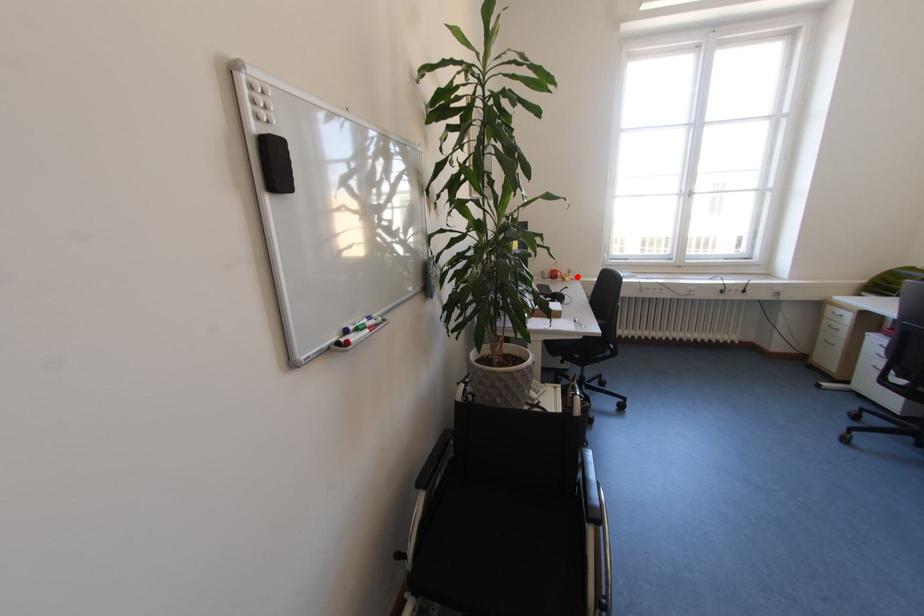
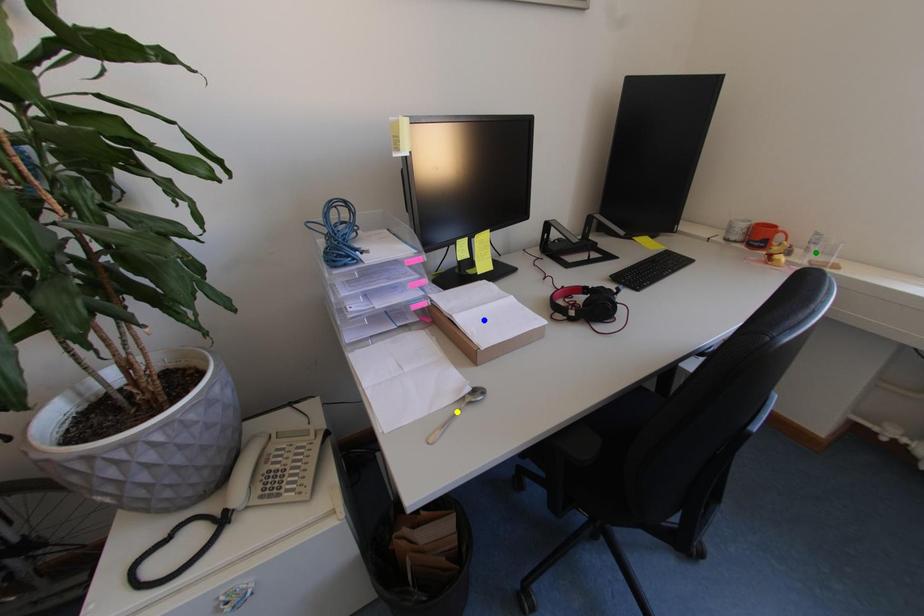
Question: I am providing you with two images of the same scene from different viewpoints. A red point is marked on the first image. You are given multiple points on the second image. Can you choose the point in image 2 that corresponds to the point in image 1?

Choices:
 (A) blue point
 (B) yellow point
 (C) green point

Answer: (C)